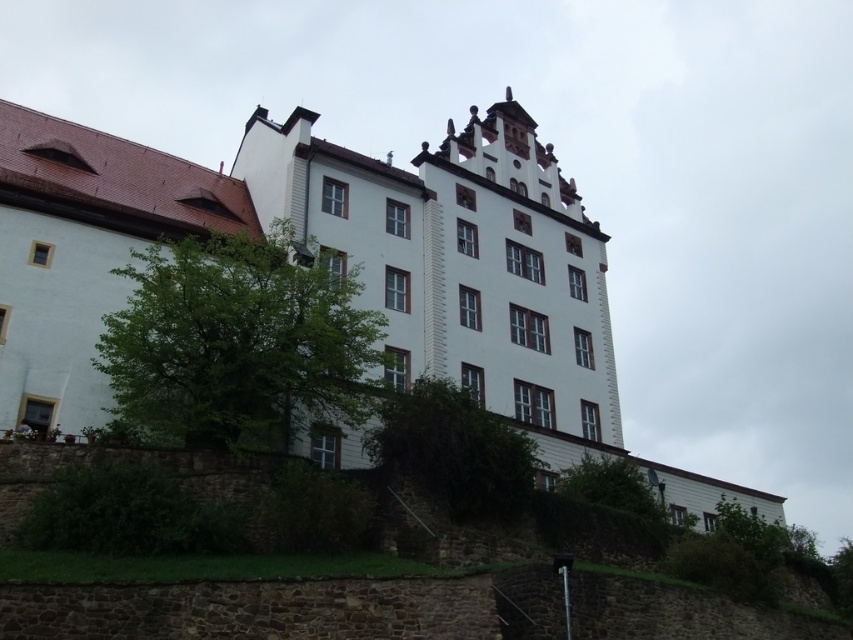
You are standing in front of the historic building and want to take a photo of the green leafy tree at lower right. However, the green leafy bush at center is blocking your view. Can you move to the side to get a clear shot of the tree without the bush in the way?

The green leafy bush at center is in front of the green leafy tree at lower right, so moving to the side might allow you to position yourself where the bush no longer blocks the tree, providing a clear view.